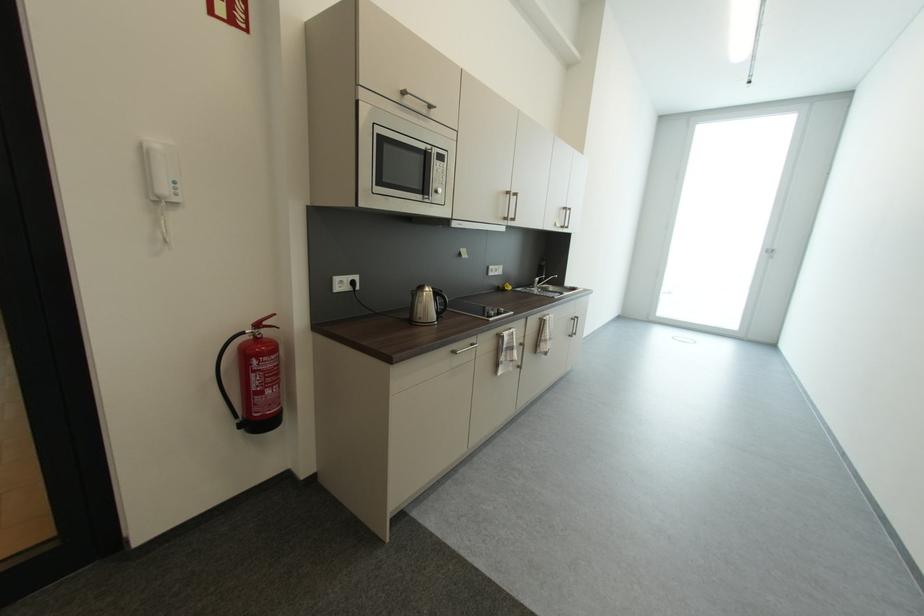
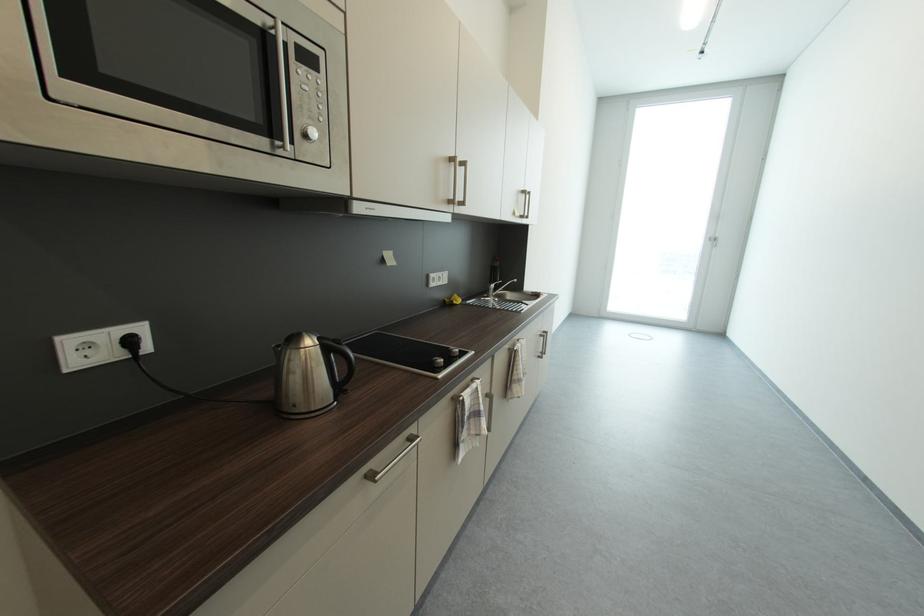
Find the pixel in the second image that matches (x=552, y=321) in the first image.

(523, 351)